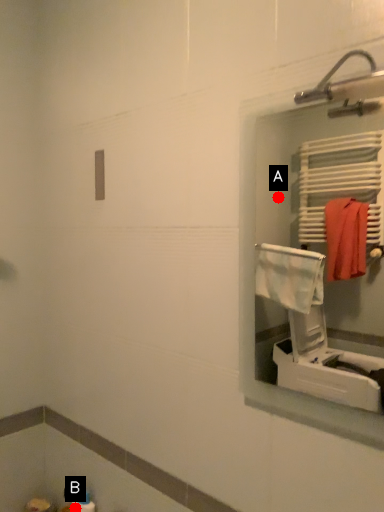
Question: Two points are circled on the image, labeled by A and B beside each circle. Which of the following is the closest to the observer?

Choices:
 (A) A is closer
 (B) B is closer

Answer: (B)